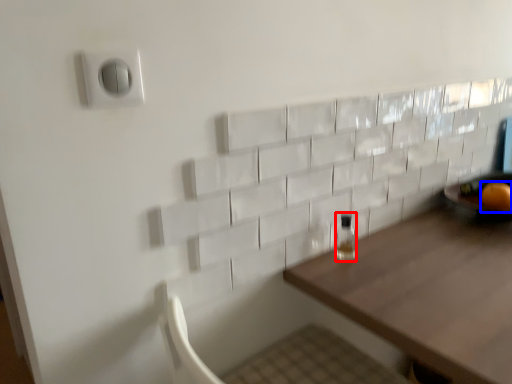
Question: Which object appears closest to the camera in this image, bottle (highlighted by a red box) or orange (highlighted by a blue box)?

Choices:
 (A) bottle
 (B) orange

Answer: (A)